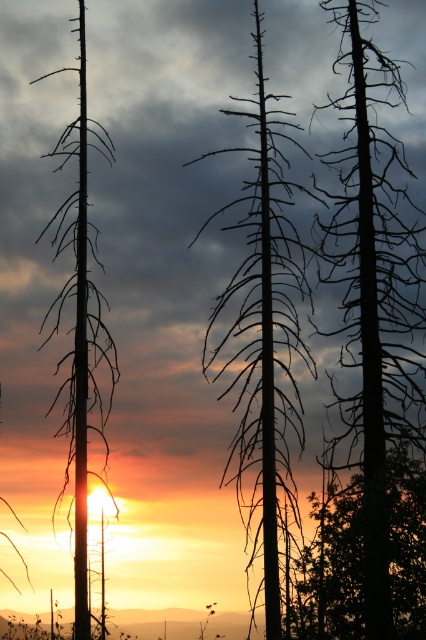
Question: Which point is closer to the camera?

Choices:
 (A) (287, 314)
 (B) (400, 237)
 (C) (111, 140)

Answer: (A)

Question: Does black deadwood tree at center have a larger size compared to silhouette deadwood at left?

Choices:
 (A) yes
 (B) no

Answer: (B)

Question: Which object appears farthest from the camera in this image?

Choices:
 (A) silhouette bark tree at center
 (B) black deadwood tree at center

Answer: (B)

Question: Which of the following is the farthest from the observer?

Choices:
 (A) black deadwood tree at center
 (B) silhouette deadwood at left

Answer: (A)

Question: Is black deadwood tree at center to the right of silhouette bark tree at center from the viewer's perspective?

Choices:
 (A) no
 (B) yes

Answer: (B)

Question: Does silhouette bark tree at center have a lesser width compared to silhouette deadwood at left?

Choices:
 (A) yes
 (B) no

Answer: (B)